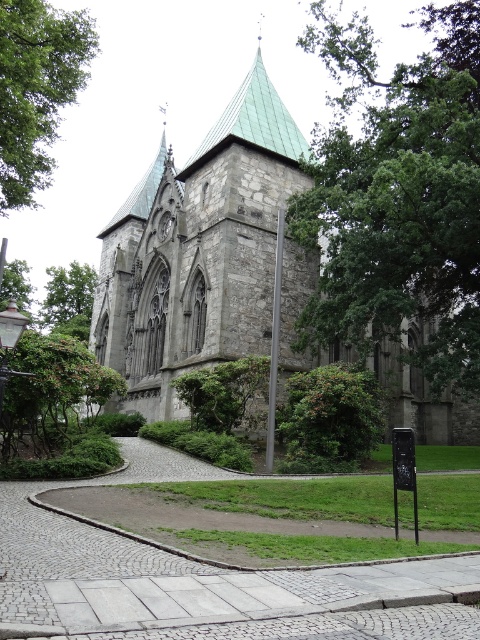
How far apart are green leafy tree at upper right and green leafy bush at center?

green leafy tree at upper right is 19.95 meters from green leafy bush at center.

Which is below, green leafy tree at upper right or green leafy bush at center?

green leafy bush at center is lower down.

This screenshot has height=640, width=480. Find the location of `green leafy tree at upper right`. green leafy tree at upper right is located at coordinates (399, 195).

Image resolution: width=480 pixels, height=640 pixels. I want to click on green leafy tree at upper right, so click(x=399, y=195).

Describe the element at coordinates (197, 252) in the screenshot. I see `stone church at center` at that location.

Is point (409, 387) closer to viewer compared to point (453, 282)?

No, (409, 387) is further to viewer.

Describe the element at coordinates (197, 252) in the screenshot. I see `stone church at center` at that location.

The height and width of the screenshot is (640, 480). Identify the location of stone church at center. click(x=197, y=252).

Is stone church at center positioned in front of green leafy tree at upper left?

No, it is not.

Is point (251, 275) positioned after point (4, 138)?

Yes, point (251, 275) is behind point (4, 138).

This screenshot has width=480, height=640. Identify the location of stone church at center. (197, 252).

In order to click on stone church at center in this screenshot , I will do `click(197, 252)`.